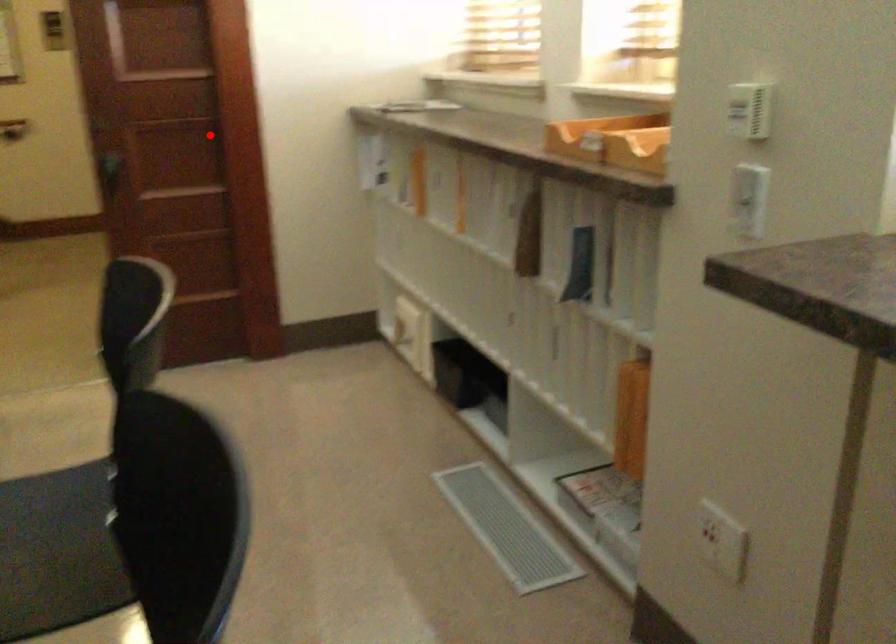
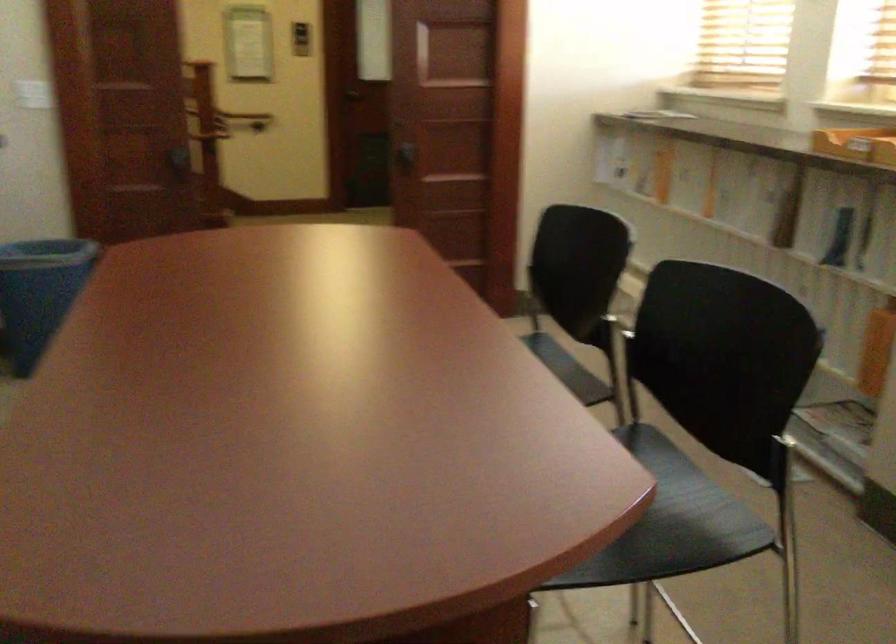
Locate, in the second image, the point that corresponds to the highlighted location in the first image.

(460, 133)